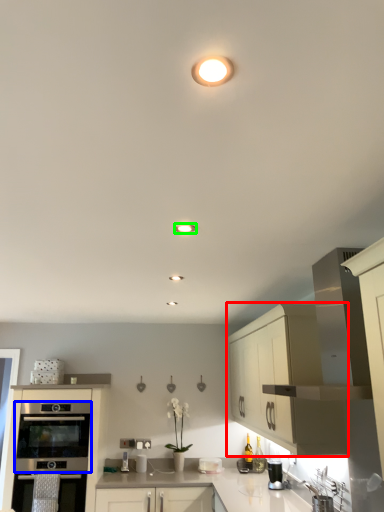
Question: Considering the real-world distances, which object is closest to cabinetry (highlighted by a red box)? oven (highlighted by a blue box) or lighting (highlighted by a green box).

Choices:
 (A) oven
 (B) lighting

Answer: (B)